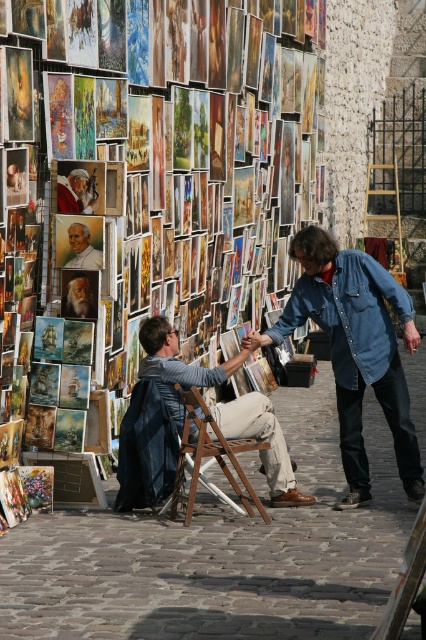
Question: Among these objects, which one is nearest to the camera?

Choices:
 (A) denim jacket at center
 (B) matte canvas paintings at left
 (C) denim jacket at lower right
 (D) matte black portrait at center

Answer: (B)

Question: Can you confirm if matte canvas paintings at left is smaller than matte gold frame at center?

Choices:
 (A) no
 (B) yes

Answer: (A)

Question: Observing the image, what is the correct spatial positioning of denim jacket at center in reference to matte red jacket at center?

Choices:
 (A) below
 (B) above

Answer: (A)

Question: Which object is closer to the camera taking this photo?

Choices:
 (A) denim jacket at center
 (B) faded denim jacket at lower right

Answer: (A)

Question: Which point is farther to the camera?

Choices:
 (A) denim jacket at lower right
 (B) matte black portrait at center

Answer: (B)

Question: Considering the relative positions of matte black portrait at center and matte red jacket at center in the image provided, where is matte black portrait at center located with respect to matte red jacket at center?

Choices:
 (A) right
 (B) left

Answer: (A)